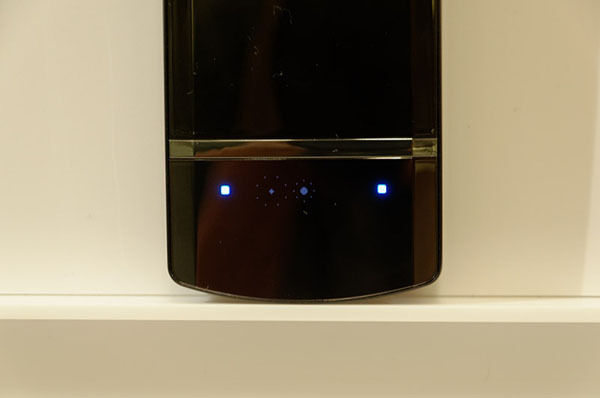
The image size is (600, 398). I want to click on beige wall, so click(x=71, y=127).